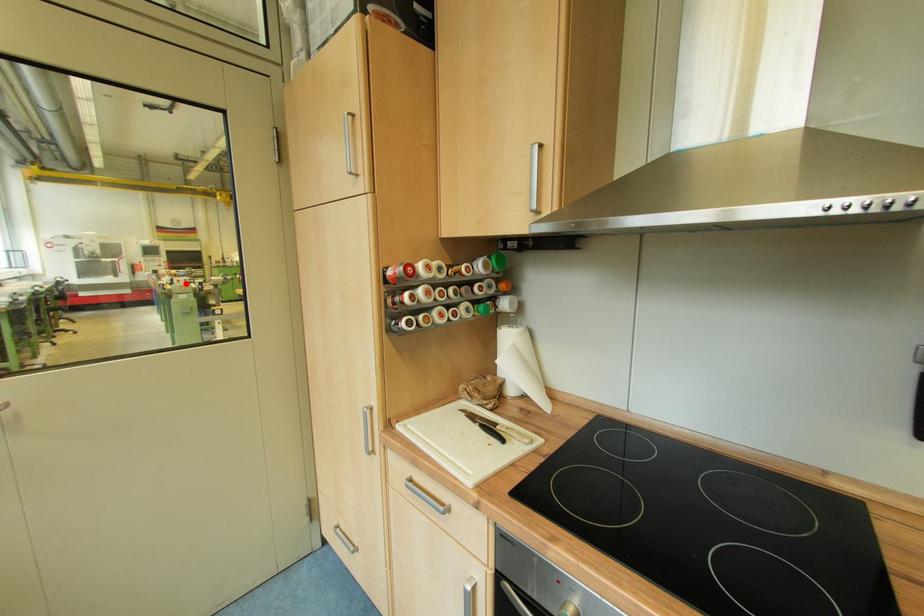
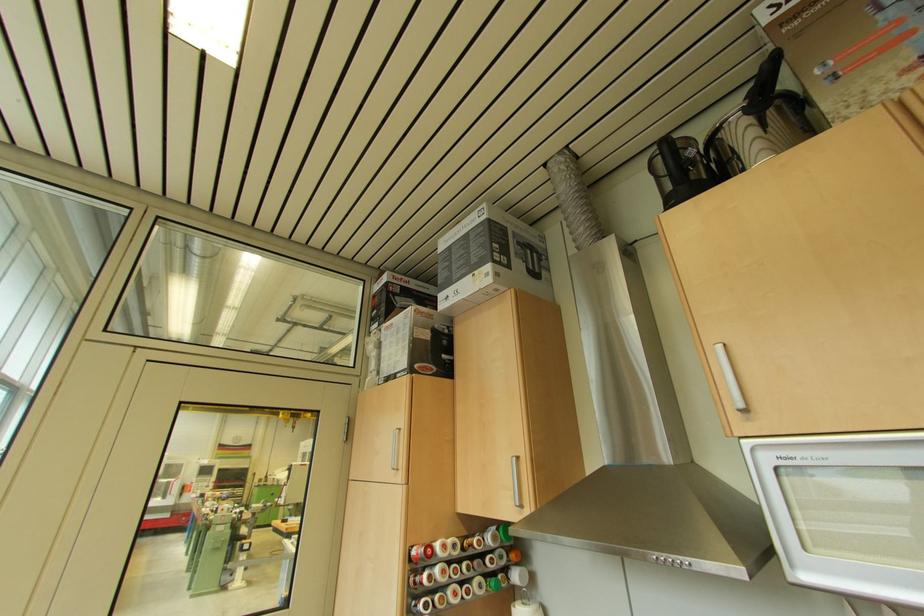
Locate, in the second image, the point that corresponds to the highlighted location in the first image.

(229, 513)